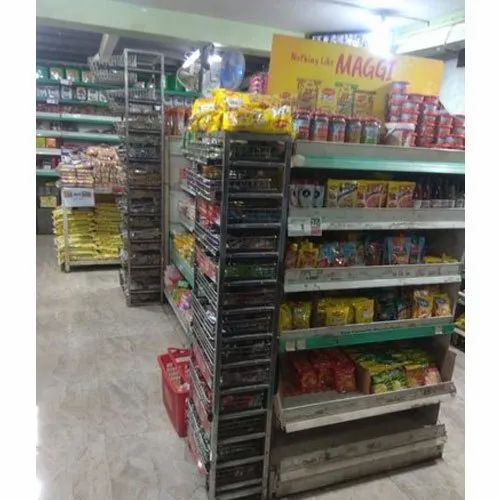
You are a GUI agent. You are given a task and a screenshot of the screen. Output one action in this format:
    pyautogui.click(x=<x>, y=<y>)
    Task: Click on the shelves
    This screenshot has height=500, width=500.
    Given the screenshot: What is the action you would take?
    pyautogui.click(x=366, y=447), pyautogui.click(x=357, y=404), pyautogui.click(x=358, y=334), pyautogui.click(x=358, y=277), pyautogui.click(x=369, y=218), pyautogui.click(x=377, y=154)